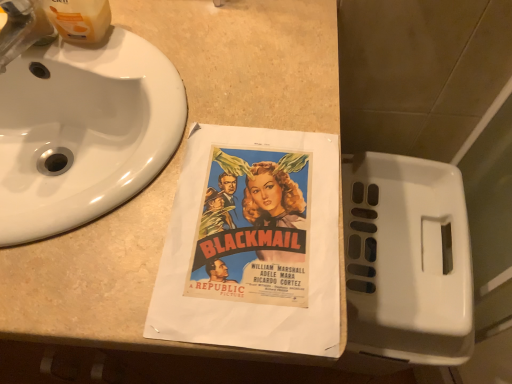
Question: Is white glossy sink at upper left far away from brushed metal faucet at upper left?

Choices:
 (A) no
 (B) yes

Answer: (A)

Question: Does white glossy sink at upper left appear on the right side of brushed metal faucet at upper left?

Choices:
 (A) yes
 (B) no

Answer: (A)

Question: Is white glossy sink at upper left wider than brushed metal faucet at upper left?

Choices:
 (A) yes
 (B) no

Answer: (A)

Question: Can you confirm if white glossy sink at upper left is shorter than brushed metal faucet at upper left?

Choices:
 (A) yes
 (B) no

Answer: (B)

Question: Is white glossy sink at upper left next to brushed metal faucet at upper left and touching it?

Choices:
 (A) yes
 (B) no

Answer: (B)

Question: Is point (53, 228) closer or farther from the camera than point (0, 34)?

Choices:
 (A) farther
 (B) closer

Answer: (B)

Question: In terms of size, does white glossy sink at upper left appear bigger or smaller than brushed metal faucet at upper left?

Choices:
 (A) big
 (B) small

Answer: (A)

Question: In terms of width, does white glossy sink at upper left look wider or thinner when compared to brushed metal faucet at upper left?

Choices:
 (A) thin
 (B) wide

Answer: (B)

Question: Considering their positions, is white glossy sink at upper left located in front of or behind brushed metal faucet at upper left?

Choices:
 (A) behind
 (B) front

Answer: (B)

Question: Based on their sizes in the image, would you say beige laminate counter at center is bigger or smaller than white glossy sink at upper left?

Choices:
 (A) small
 (B) big

Answer: (B)

Question: From the image's perspective, is beige laminate counter at center located above or below white glossy sink at upper left?

Choices:
 (A) above
 (B) below

Answer: (B)

Question: From a real-world perspective, is beige laminate counter at center positioned above or below white glossy sink at upper left?

Choices:
 (A) above
 (B) below

Answer: (B)

Question: Visually, is beige laminate counter at center positioned to the left or to the right of white glossy sink at upper left?

Choices:
 (A) left
 (B) right

Answer: (A)

Question: Considering the positions of point (7, 23) and point (91, 168), is point (7, 23) closer or farther from the camera than point (91, 168)?

Choices:
 (A) closer
 (B) farther

Answer: (A)

Question: From their relative heights in the image, would you say brushed metal faucet at upper left is taller or shorter than white glossy sink at upper left?

Choices:
 (A) short
 (B) tall

Answer: (A)